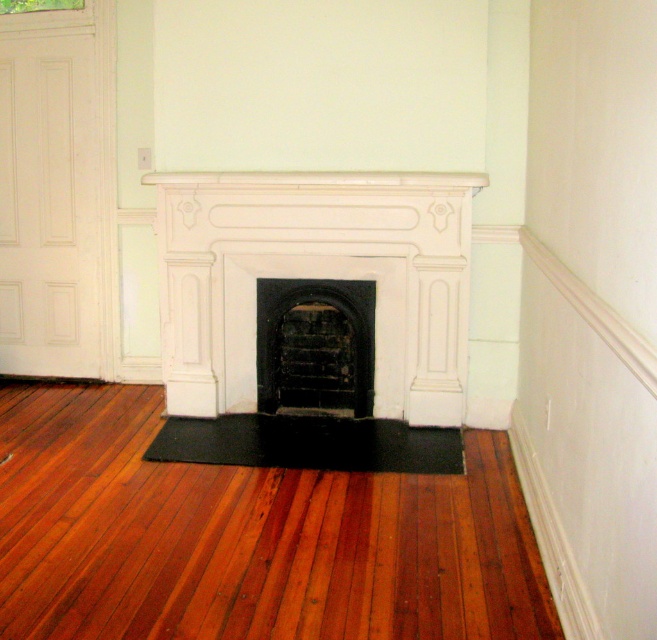
You are standing in the room and want to place a decorative item on the mantel. Which fireplace, the white stone fireplace at center or the black matte fireplace at center, should you approach to place the item?

The white stone fireplace at center is positioned on the right side of the black matte fireplace at center, so you should approach the white stone fireplace at center to place the decorative item on its mantel.

In the scene shown: You are a house inspector examining the room. You notice the black matte fireplace at center and the black rubber mat at center. According to the scene description, which object is located to the right of the other?

The black matte fireplace at center is positioned on the right side of black rubber mat at center, so the fireplace is to the right of the mat.

You are standing in the room and want to place a decorative item exactly at the point marked as point (246, 536). What type of flooring material will the item be placed on?

The point (246, 536) is on shiny brown wood flooring at center, so the decorative item will be placed on the shiny brown wood flooring at center.